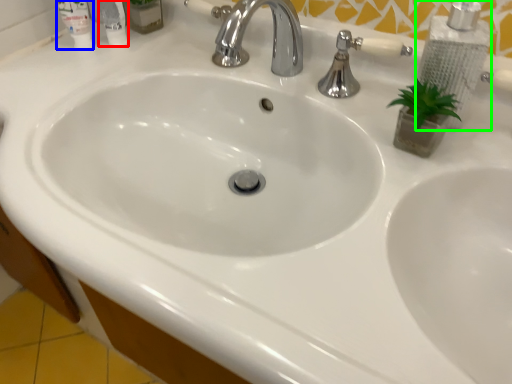
Question: Which object is the farthest from mouthwash (highlighted by a red box)? Choose among these: mouthwash (highlighted by a blue box) or soap dispenser (highlighted by a green box).

Choices:
 (A) mouthwash
 (B) soap dispenser

Answer: (B)